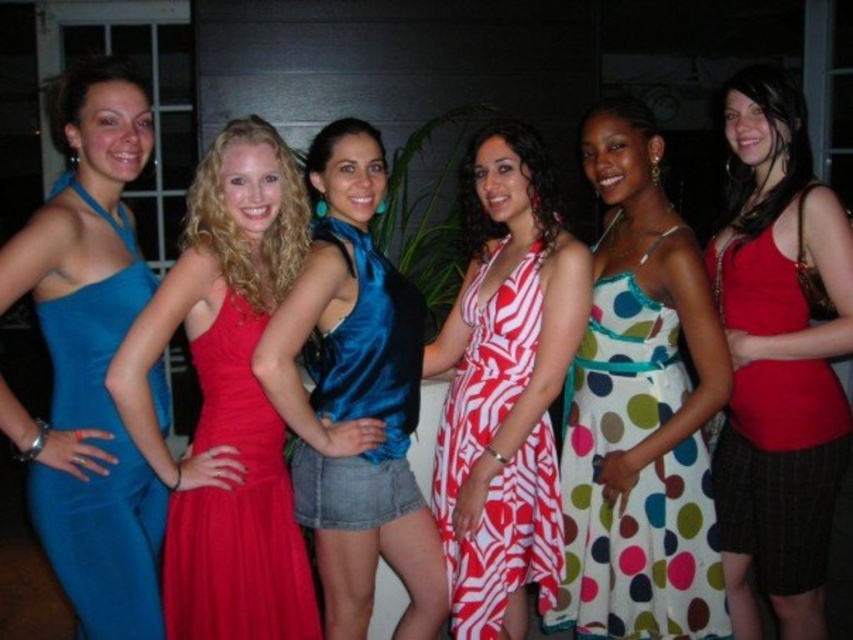
You are a photographer trying to capture a group photo of the women in the scene. You need to ensure that both the red satin tank top at center and the multicolored polka dot dress at center are clearly visible in the frame. Based on their positions, which clothing item should you focus on first to ensure it doesn

The red satin tank top at center is taller than the multicolored polka dot dress at center, so you should focus on the red satin tank top at center first to ensure it doesn

You are a photographer at the event and want to take a photo that includes both the matte blue dress at left and the shiny satin dress at center. Based on their positions, which dress should you focus on first to ensure both are in frame?

The matte blue dress at left is above the shiny satin dress at center, so focusing on the matte blue dress at left first will help ensure both are in frame.

You are a photographer at a night event. You want to capture a closeup shot of the red satin tank top at center and the multicolored polka dot dress at center. The minimum distance your camera can focus on two subjects is 10 inches. Can you take the photo?

The red satin tank top at center is 10.36 inches from the multicolored polka dot dress at center, so yes, the camera can focus on both subjects since the distance between them is within the minimum focus distance requirement of 10 inches.